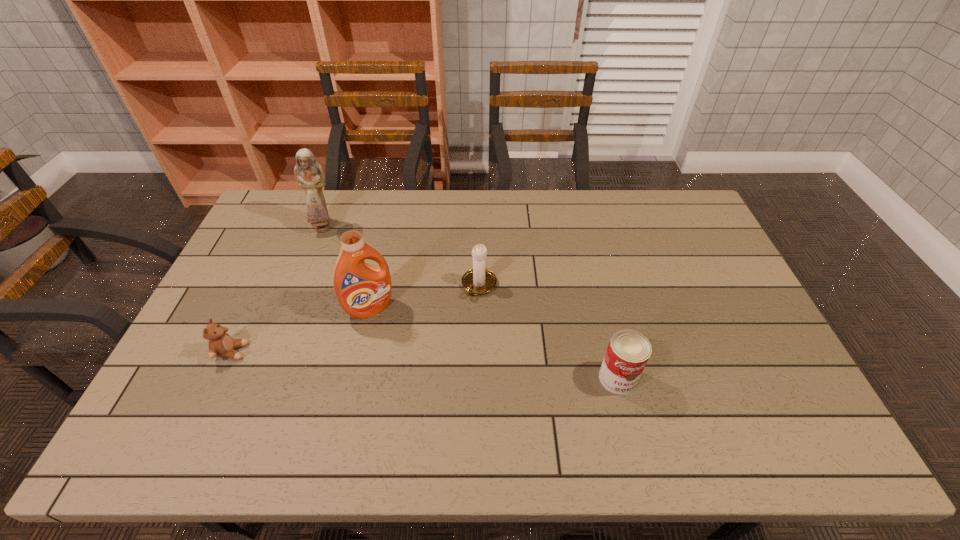
Locate an element on the screen. Image resolution: width=960 pixels, height=540 pixels. teddy bear is located at coordinates (221, 344).

Locate an element on the screen. The image size is (960, 540). the leftmost object is located at coordinates click(221, 344).

Find the location of a particular element. can is located at coordinates (628, 351).

Where is `the rightmost object`? This screenshot has width=960, height=540. the rightmost object is located at coordinates (628, 351).

Locate an element on the screen. The image size is (960, 540). the third object from right to left is located at coordinates (362, 290).

The height and width of the screenshot is (540, 960). I want to click on the fourth object from right to left, so click(309, 174).

At what (x,y) coordinates should I click in order to perform the action: click on figurine. Please return your answer as a coordinate pair (x, y). Image resolution: width=960 pixels, height=540 pixels. Looking at the image, I should click on (309, 174).

Identify the location of candle holder. The image size is (960, 540). (479, 281).

Find the location of a particular element. blank space located on the front-facing side of the leftmost object is located at coordinates (369, 352).

Where is `blank area located on the front-facing side of the detergent`? blank area located on the front-facing side of the detergent is located at coordinates (431, 403).